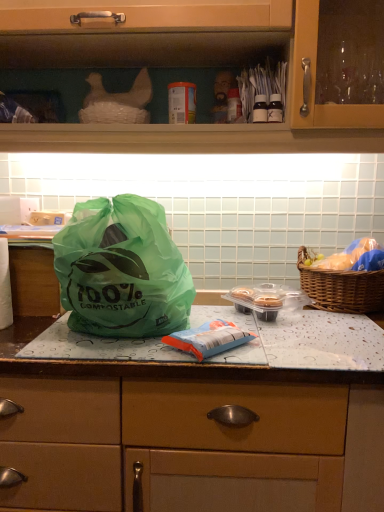
Question: Is brown woven picnic basket at right surrounding green plastic bag at center?

Choices:
 (A) yes
 (B) no

Answer: (B)

Question: From a real-world perspective, is brown woven picnic basket at right positioned under green plastic bag at center based on gravity?

Choices:
 (A) no
 (B) yes

Answer: (A)

Question: Is brown woven picnic basket at right to the left of green plastic bag at center from the viewer's perspective?

Choices:
 (A) yes
 (B) no

Answer: (B)

Question: Does brown woven picnic basket at right have a greater height compared to green plastic bag at center?

Choices:
 (A) no
 (B) yes

Answer: (B)

Question: Is the position of brown woven picnic basket at right more distant than that of green plastic bag at center?

Choices:
 (A) yes
 (B) no

Answer: (A)

Question: Is brown woven picnic basket at right completely or partially outside of green plastic bag at center?

Choices:
 (A) yes
 (B) no

Answer: (A)

Question: Is green plastic bag at center at the right side of translucent plastic bag at right, the 1th food viewed from the top?

Choices:
 (A) yes
 (B) no

Answer: (B)

Question: Is translucent plastic bag at right, positioned as the 1th food in right-to-left order, located within green plastic bag at center?

Choices:
 (A) yes
 (B) no

Answer: (B)

Question: Considering the relative sizes of green plastic bag at center and translucent plastic bag at right, positioned as the 1th food in right-to-left order, in the image provided, is green plastic bag at center thinner than translucent plastic bag at right, positioned as the 1th food in right-to-left order,?

Choices:
 (A) no
 (B) yes

Answer: (A)

Question: From a real-world perspective, is green plastic bag at center beneath translucent plastic bag at right, the 1th food viewed from the top?

Choices:
 (A) no
 (B) yes

Answer: (B)

Question: From a real-world perspective, is green plastic bag at center on top of translucent plastic bag at right, the second food viewed from the front?

Choices:
 (A) no
 (B) yes

Answer: (A)

Question: Is the depth of green plastic bag at center less than that of translucent plastic bag at right, the first food viewed from the back?

Choices:
 (A) yes
 (B) no

Answer: (A)

Question: From a real-world perspective, is blue matte plastic bag at center, which ranks as the 1th food in left-to-right order, on top of green plastic bag at center?

Choices:
 (A) no
 (B) yes

Answer: (B)